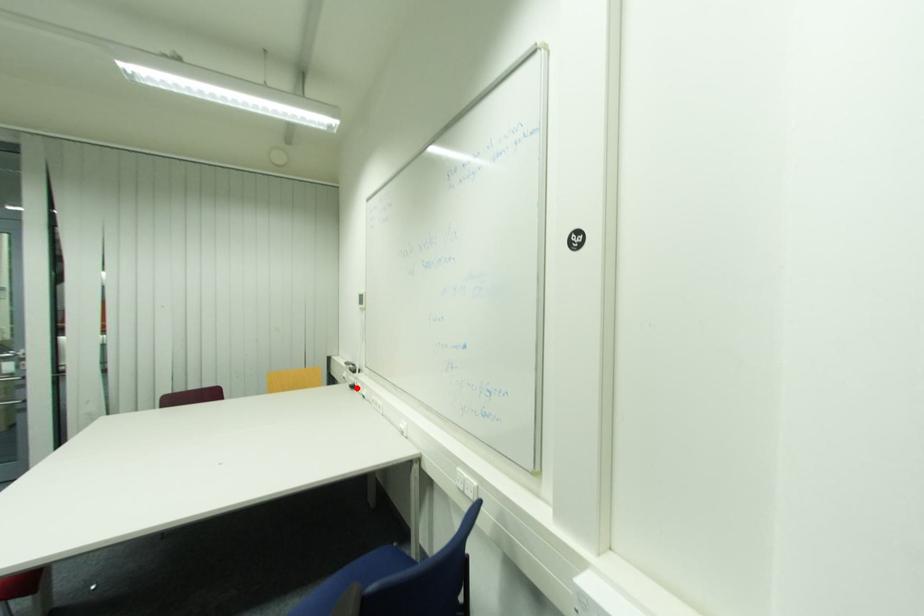
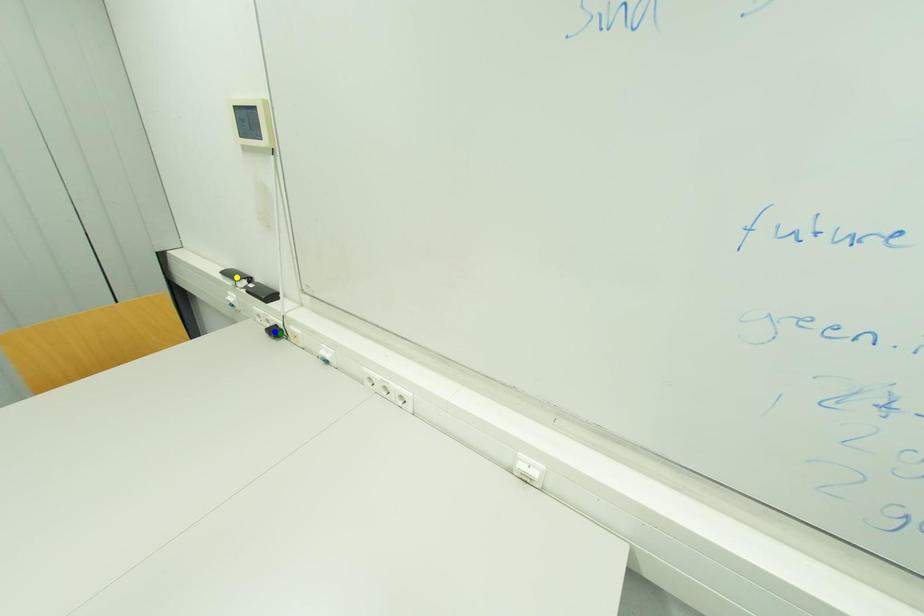
Question: I am providing you with two images of the same scene from different viewpoints. A red point is marked on the first image. You are given multiple points on the second image. Which point in image 2 represents the same 3d spot as the red point in image 1?

Choices:
 (A) blue point
 (B) green point
 (C) yellow point

Answer: (B)